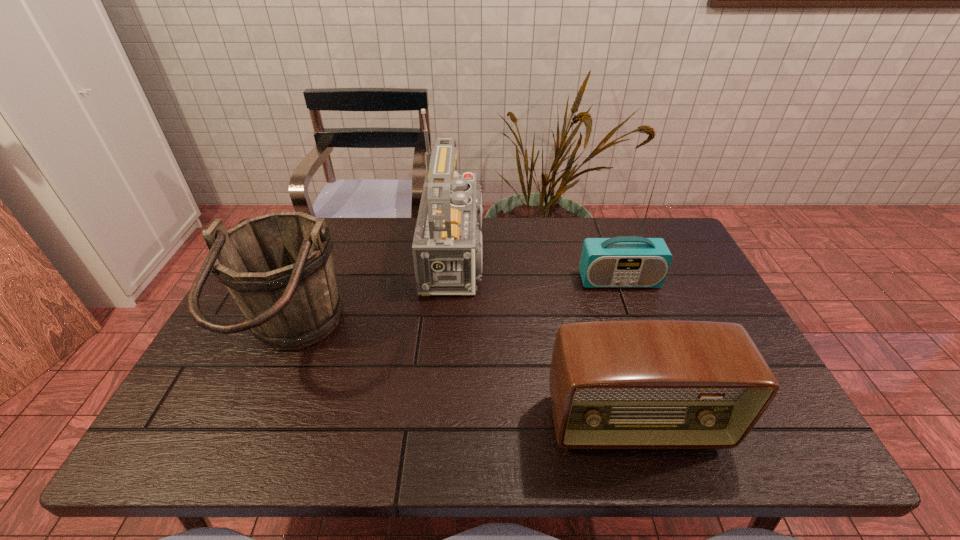
Find the location of `the second object from left to right`. the second object from left to right is located at coordinates (447, 247).

Locate an element on the screen. the second shortest radio receiver is located at coordinates (626, 261).

At what (x,y) coordinates should I click in order to perform the action: click on bucket. Please return your answer as a coordinate pair (x, y). Looking at the image, I should click on (278, 267).

The width and height of the screenshot is (960, 540). Find the location of `the shortest object`. the shortest object is located at coordinates (636, 384).

Find the location of a particular element. the shortest radio receiver is located at coordinates (636, 384).

The image size is (960, 540). In order to click on free space located 0.380m on the front-facing side of the third object from right to left in this screenshot , I will do `click(624, 254)`.

You are a GUI agent. You are given a task and a screenshot of the screen. Output one action in this format:
    pyautogui.click(x=<x>, y=<y>)
    Task: Click on the vacant position located on the front panel of the second tallest radio receiver
    The image size is (960, 540).
    Given the screenshot: What is the action you would take?
    pyautogui.click(x=652, y=371)

This screenshot has height=540, width=960. Identify the location of vacant region located on the handle side of the leftmost object. (415, 338).

Identify the location of object that is at the far edge. This screenshot has height=540, width=960. (447, 247).

The height and width of the screenshot is (540, 960). In order to click on object positioned at the near edge in this screenshot , I will do `click(636, 384)`.